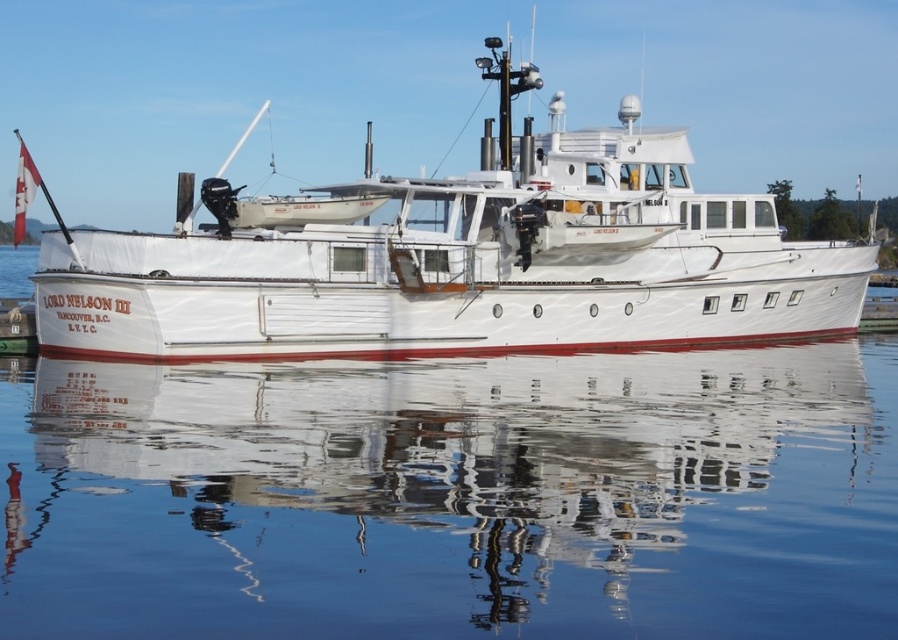
Question: Among these objects, which one is nearest to the camera?

Choices:
 (A) transparent water at center
 (B) white wooden boat at center

Answer: (A)

Question: Can you confirm if transparent water at center is positioned to the left of white wooden boat at center?

Choices:
 (A) yes
 (B) no

Answer: (B)

Question: Which point is closer to the camera?

Choices:
 (A) (102, 264)
 (B) (854, 600)

Answer: (B)

Question: Can you confirm if transparent water at center is thinner than white wooden boat at center?

Choices:
 (A) yes
 (B) no

Answer: (A)

Question: Can you confirm if transparent water at center is positioned above white wooden boat at center?

Choices:
 (A) no
 (B) yes

Answer: (A)